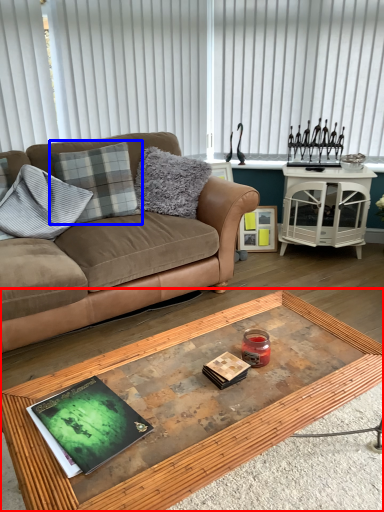
Question: Which point is further to the camera, coffee table (highlighted by a red box) or pillow (highlighted by a blue box)?

Choices:
 (A) coffee table
 (B) pillow

Answer: (B)